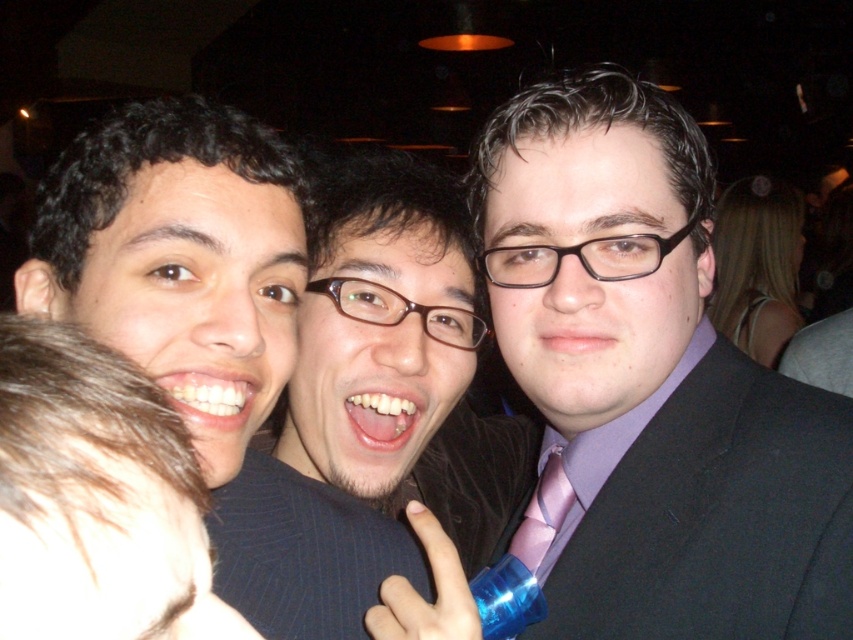
You are at a party and want to get a drink from the bartender. There is a brown pinstriped suit at center and a matte black hair at left in your way. Which direction should you move to avoid both?

To avoid both the brown pinstriped suit at center and the matte black hair at left, you should move to the right since the brown pinstriped suit at center is already positioned to the right of the matte black hair at left, so moving further right would clear both.

You are a photographer at the event and want to ensure everyone is visible in the photo. Given that the brown pinstriped suit at center and the matte black hair at left are in the frame, which one should you ask to stand on a stool to ensure their face is visible over the crowd?

The matte black hair at left should stand on a stool because the brown pinstriped suit at center is much taller, so the shorter matte black hair at left may need elevation to be seen over the crowd.